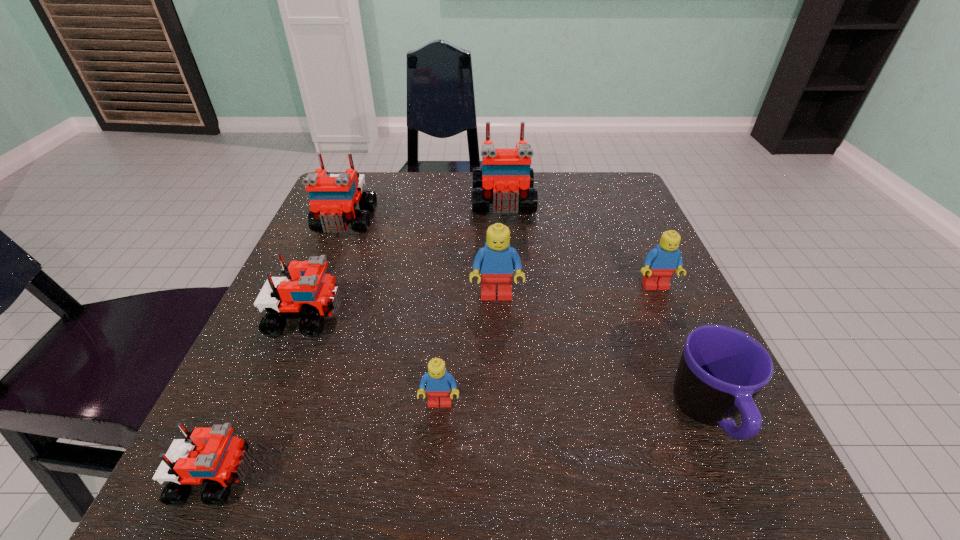
At what (x,y) coordinates should I click in order to perform the action: click on blank area at the far right corner. Please return your answer as a coordinate pair (x, y). The height and width of the screenshot is (540, 960). Looking at the image, I should click on (597, 173).

This screenshot has width=960, height=540. What are the coordinates of `vacant space at the near right corner` in the screenshot? It's located at (652, 482).

At what (x,y) coordinates should I click in order to perform the action: click on free area in between the tallest object and the black mug. Please return your answer as a coordinate pair (x, y). Image resolution: width=960 pixels, height=540 pixels. Looking at the image, I should click on (606, 309).

Find the location of a particular element. free space between the fifth object from right to left and the second biggest blue Lego is located at coordinates (547, 345).

Locate an element on the screen. vacant area that lies between the third smallest red Lego and the second blue Lego from left to right is located at coordinates (420, 259).

The width and height of the screenshot is (960, 540). I want to click on vacant area between the black mug and the third smallest red Lego, so click(x=526, y=319).

Where is `free space between the nearest Lego and the second nearest red Lego`? free space between the nearest Lego and the second nearest red Lego is located at coordinates (261, 397).

This screenshot has width=960, height=540. I want to click on blank region between the second smallest red Lego and the nearest red Lego, so click(x=261, y=397).

The width and height of the screenshot is (960, 540). I want to click on vacant region between the second biggest red Lego and the nearest Lego, so click(280, 350).

Image resolution: width=960 pixels, height=540 pixels. I want to click on vacant space that is in between the third biggest red Lego and the smallest blue Lego, so click(x=373, y=360).